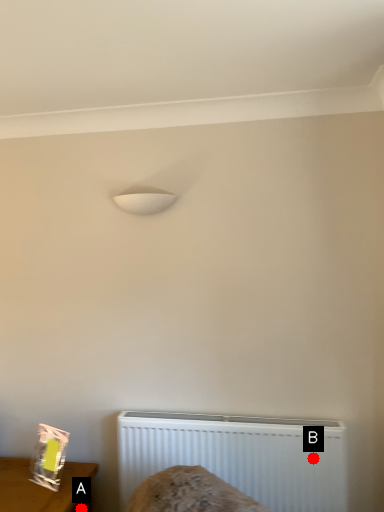
Question: Two points are circled on the image, labeled by A and B beside each circle. Which point is closer to the camera?

Choices:
 (A) A is closer
 (B) B is closer

Answer: (B)